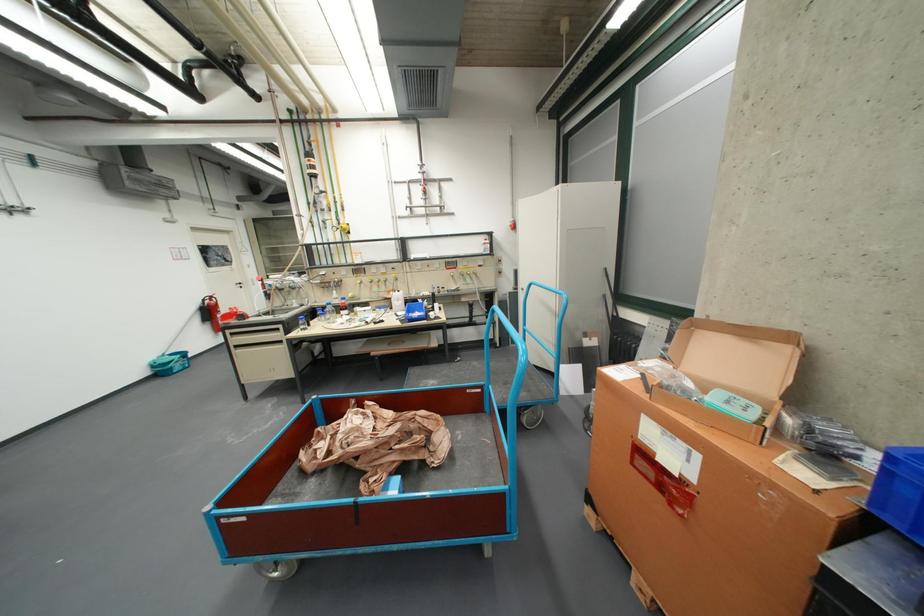
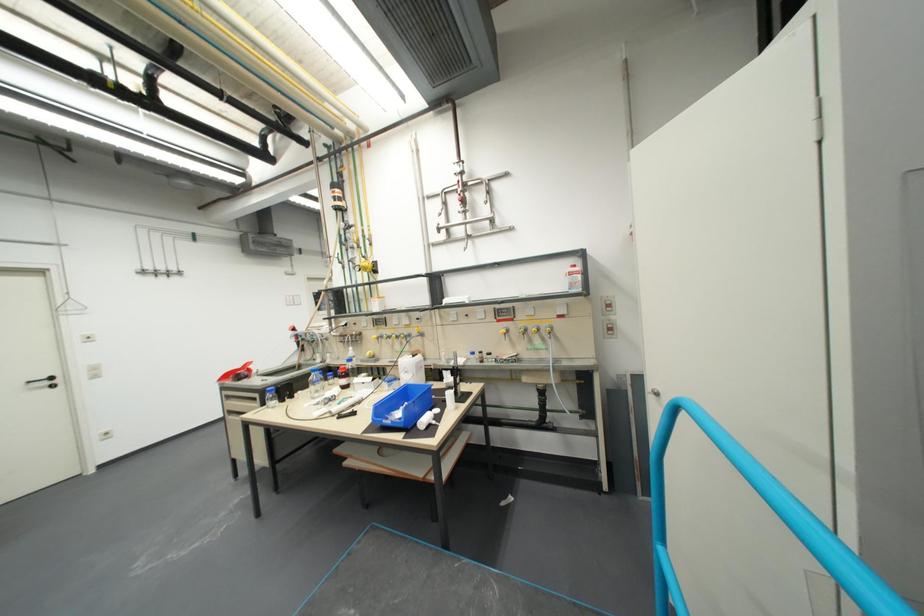
Where in the second image is the point corresponding to point (421, 183) from the first image?

(457, 193)